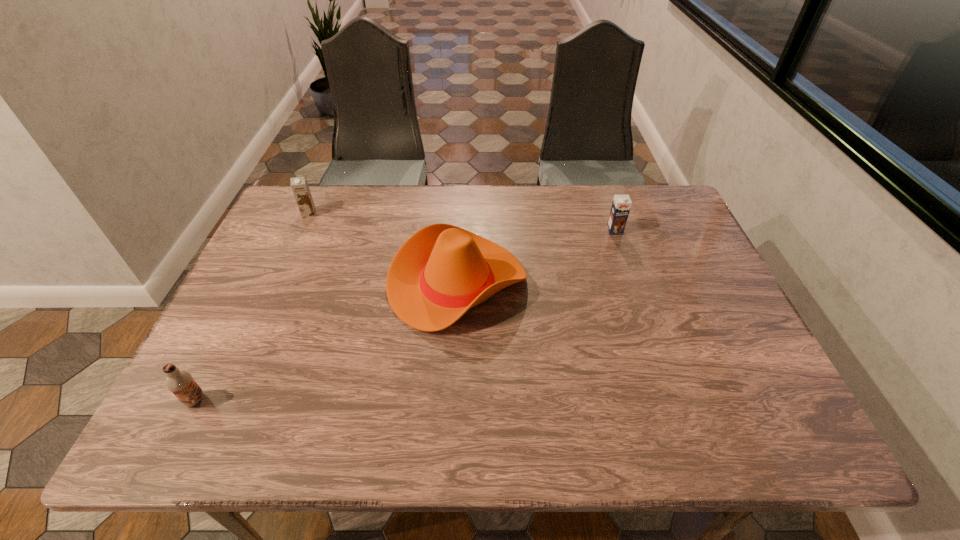
Locate an element on the screen. vacant space at the near left corner of the desktop is located at coordinates (235, 424).

In the image, there is a desktop. Identify the location of free space at the far right corner. The width and height of the screenshot is (960, 540). (679, 229).

Locate an element on the screen. Image resolution: width=960 pixels, height=540 pixels. blank region between the second chocolate milk from right to left and the rightmost chocolate milk is located at coordinates (462, 222).

Where is `blank region between the rightmost object and the farthest chocolate milk`? blank region between the rightmost object and the farthest chocolate milk is located at coordinates (462, 222).

Where is `free spot between the rightmost object and the farthest object`? This screenshot has width=960, height=540. free spot between the rightmost object and the farthest object is located at coordinates (462, 222).

Identify the location of vacant space that's between the farthest object and the second farthest object. The height and width of the screenshot is (540, 960). (462, 222).

Image resolution: width=960 pixels, height=540 pixels. I want to click on free space between the farthest chocolate milk and the second object from right to left, so click(383, 248).

This screenshot has height=540, width=960. Find the location of `empty location between the third nearest object and the second chocolate milk from right to left`. empty location between the third nearest object and the second chocolate milk from right to left is located at coordinates (462, 222).

The height and width of the screenshot is (540, 960). In order to click on free space between the second farthest object and the second chocolate milk from right to left in this screenshot , I will do `click(462, 222)`.

Where is `vacant space in between the rightmost object and the second chocolate milk from left to right`? This screenshot has width=960, height=540. vacant space in between the rightmost object and the second chocolate milk from left to right is located at coordinates (462, 222).